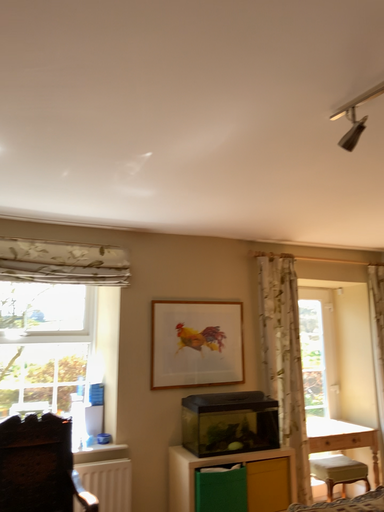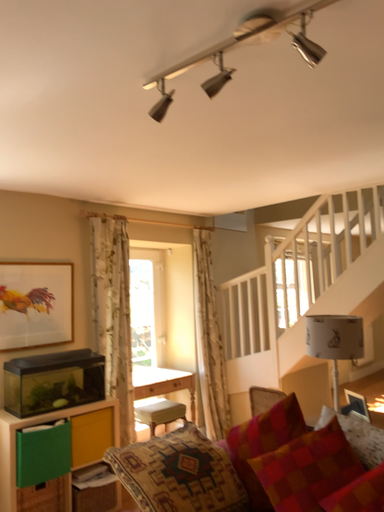
Question: How did the camera likely rotate when shooting the video?

Choices:
 (A) rotated left
 (B) rotated right

Answer: (B)